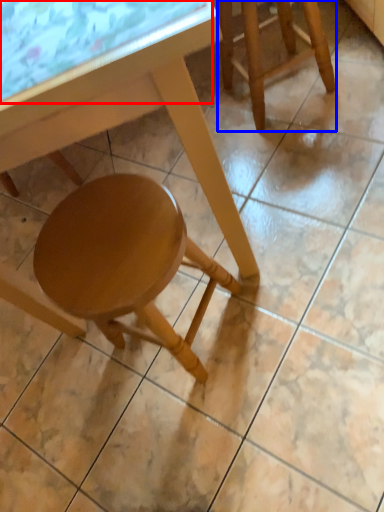
Question: Which of the following is the closest to the observer, glass table (highlighted by a red box) or stool (highlighted by a blue box)?

Choices:
 (A) glass table
 (B) stool

Answer: (A)